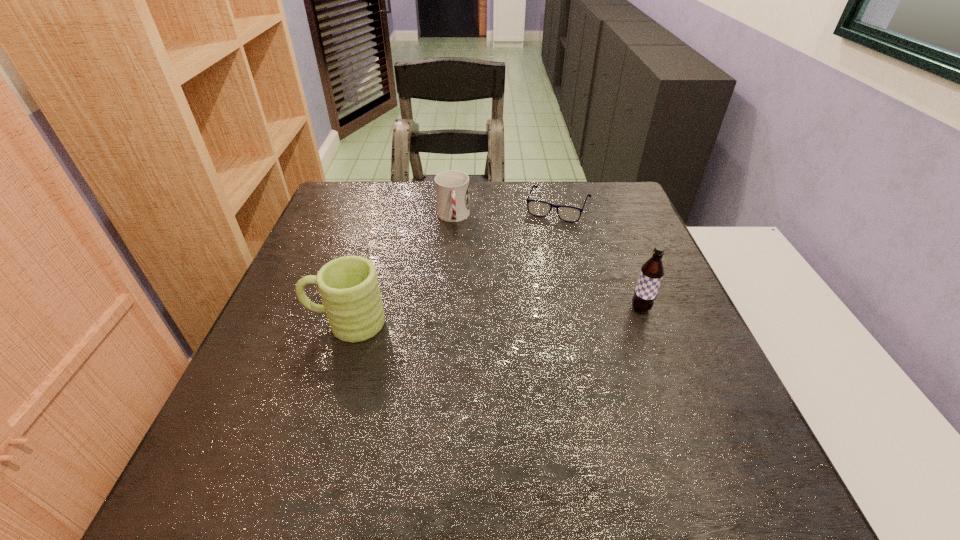
What are the coordinates of `free space located on the side of the cup where the handle is located` in the screenshot? It's located at (460, 296).

Identify the location of free space located 0.130m on the side of the cup where the handle is located. The height and width of the screenshot is (540, 960). (457, 260).

You are a GUI agent. You are given a task and a screenshot of the screen. Output one action in this format:
    pyautogui.click(x=<x>, y=<y>)
    Task: Click on the vacant space located on the side of the cup where the handle is located
    
    Given the screenshot: What is the action you would take?
    pyautogui.click(x=457, y=265)

Where is `spectacles located in the far edge section of the desktop`? spectacles located in the far edge section of the desktop is located at coordinates (537, 208).

I want to click on cup located at the far edge, so click(452, 187).

Find the location of `object that is at the left edge`. object that is at the left edge is located at coordinates (348, 286).

You are a GUI agent. You are given a task and a screenshot of the screen. Output one action in this format:
    pyautogui.click(x=<x>, y=<y>)
    Task: Click on the root beer situated at the right edge
    Image resolution: width=960 pixels, height=540 pixels.
    Given the screenshot: What is the action you would take?
    pyautogui.click(x=652, y=271)

Image resolution: width=960 pixels, height=540 pixels. What are the coordinates of `spectacles located at the right edge` in the screenshot? It's located at [x=537, y=208].

This screenshot has height=540, width=960. I want to click on object positioned at the far right corner, so click(x=537, y=208).

At what (x,y) coordinates should I click in order to perform the action: click on vacant space at the far edge of the desktop. Please return your answer as a coordinate pair (x, y). The image size is (960, 540). Looking at the image, I should click on (495, 214).